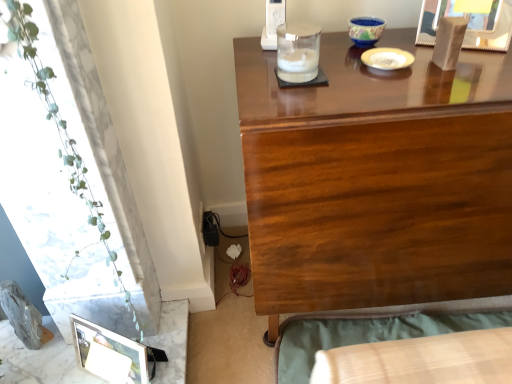
Where is `free spot to the right of blue ceramic bowl at upper center, which ranks as the 2th candle holder in left-to-right order`? The width and height of the screenshot is (512, 384). free spot to the right of blue ceramic bowl at upper center, which ranks as the 2th candle holder in left-to-right order is located at coordinates (425, 35).